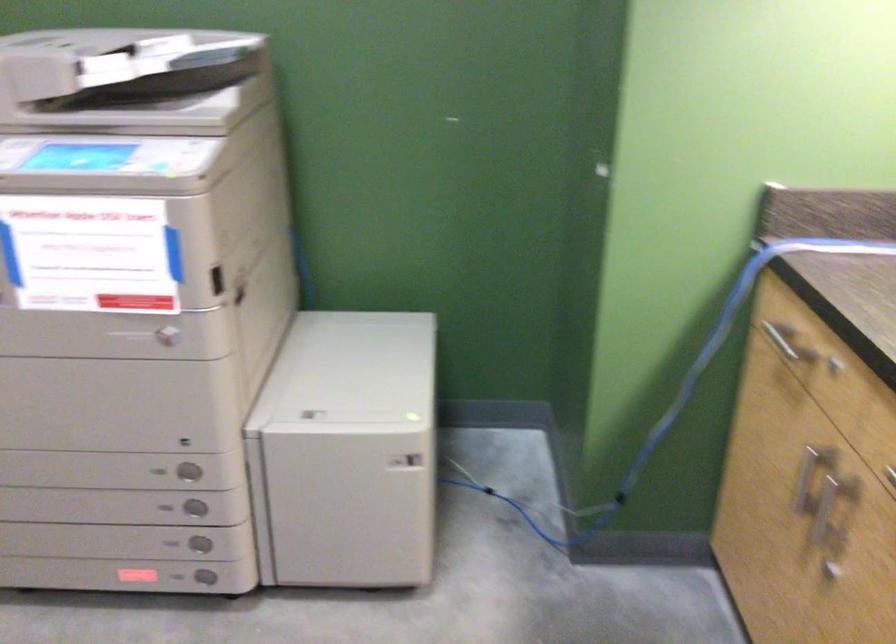
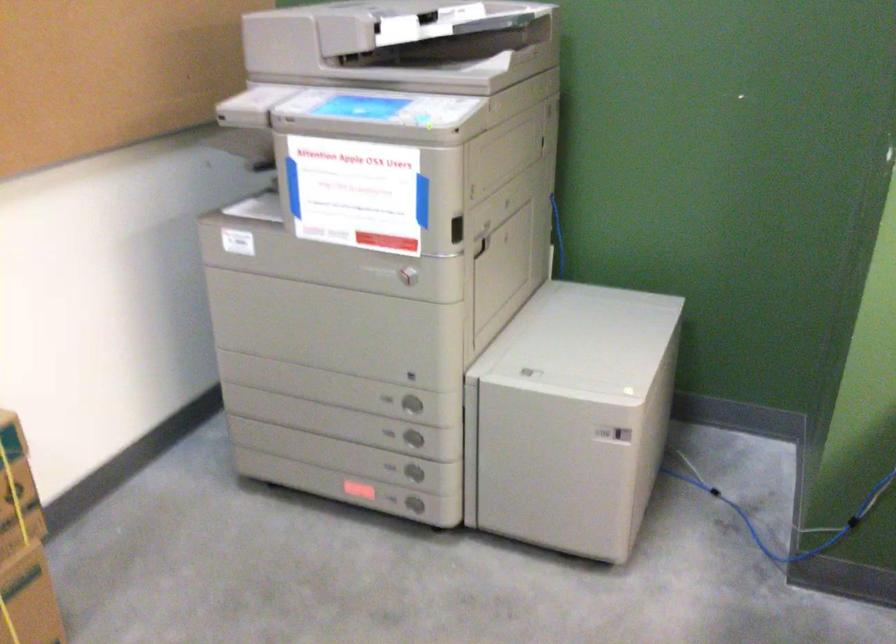
Where in the second image is the point corresponding to (201,545) from the first image?

(412, 471)